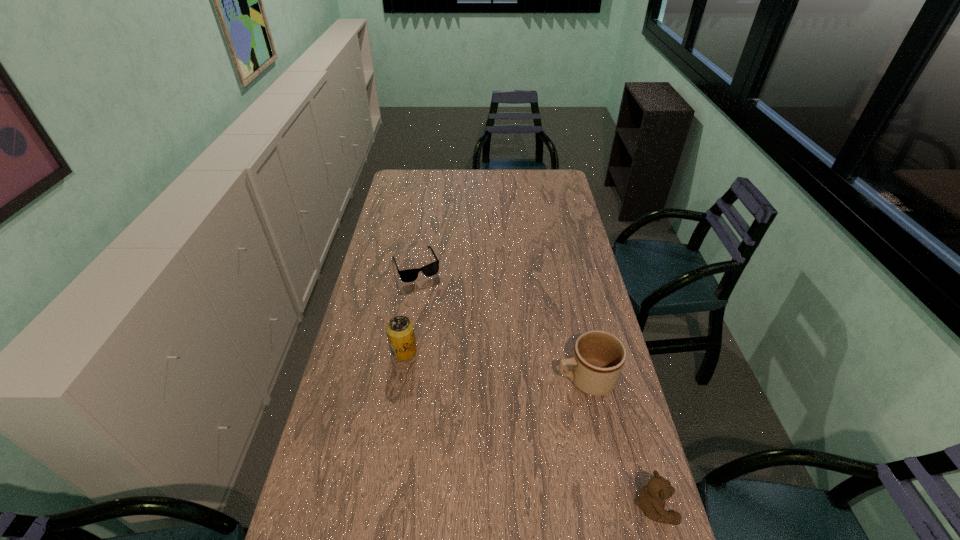
This screenshot has width=960, height=540. What are the coordinates of `vacant space that's between the mug and the beer can` in the screenshot? It's located at (494, 365).

Where is `free point between the beer can and the shortest object`? The image size is (960, 540). free point between the beer can and the shortest object is located at coordinates (410, 308).

Locate an element on the screen. vacant space in between the shortest object and the mug is located at coordinates (500, 322).

Image resolution: width=960 pixels, height=540 pixels. I want to click on free spot between the mug and the teddy bear, so click(x=619, y=442).

Image resolution: width=960 pixels, height=540 pixels. Find the location of `vacant space that's between the shortest object and the teddy bear`. vacant space that's between the shortest object and the teddy bear is located at coordinates (535, 386).

Select which object appears as the second closest to the sunglasses. Please provide its 2D coordinates. Your answer should be formatted as a tuple, i.e. [(x, y)], where the tuple contains the x and y coordinates of a point satisfying the conditions above.

[(598, 358)]

Where is `object that stands as the second closest to the mug`? The height and width of the screenshot is (540, 960). object that stands as the second closest to the mug is located at coordinates (400, 331).

At what (x,y) coordinates should I click in order to perform the action: click on free spot that satisfies the following two spatial constraints: 1. on the front side of the mug; 2. on the front-facing side of the nearest object. Please return your answer as a coordinate pair (x, y). Looking at the image, I should click on (612, 505).

The height and width of the screenshot is (540, 960). In order to click on free region that satisfies the following two spatial constraints: 1. on the front side of the nearest object; 2. on the front-facing side of the beer can in this screenshot , I will do `click(379, 505)`.